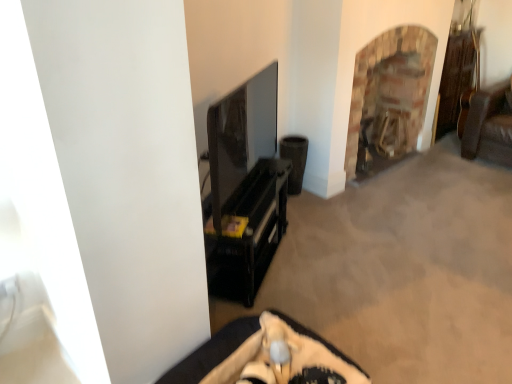
Question: From the image's perspective, is brown woven speaker at center-right above or below beige fabric cushion at lower center, the 2th furniture when ordered from back to front?

Choices:
 (A) below
 (B) above

Answer: (B)

Question: From their relative heights in the image, would you say brown woven speaker at center-right is taller or shorter than beige fabric cushion at lower center, arranged as the 2th furniture when viewed from the top?

Choices:
 (A) tall
 (B) short

Answer: (A)

Question: Which is nearer to the beige fabric cushion at lower center, which is the first furniture from bottom to top?

Choices:
 (A) brick fireplace at upper right
 (B) brown woven speaker at center-right
 (C) black glossy tv stand at center, positioned as the 1th furniture in top-to-bottom order

Answer: (C)

Question: Considering the real-world distances, which object is farthest from the brown woven speaker at center-right?

Choices:
 (A) black glossy tv stand at center, placed as the 2th furniture when sorted from front to back
 (B) beige fabric cushion at lower center, arranged as the 2th furniture when viewed from the top
 (C) brick fireplace at upper right

Answer: (B)